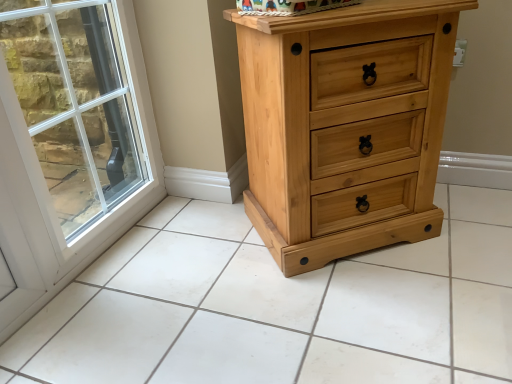
Locate an element on the screen. This screenshot has height=384, width=512. vacant space to the right of natural wood chest of drawers at right is located at coordinates (470, 225).